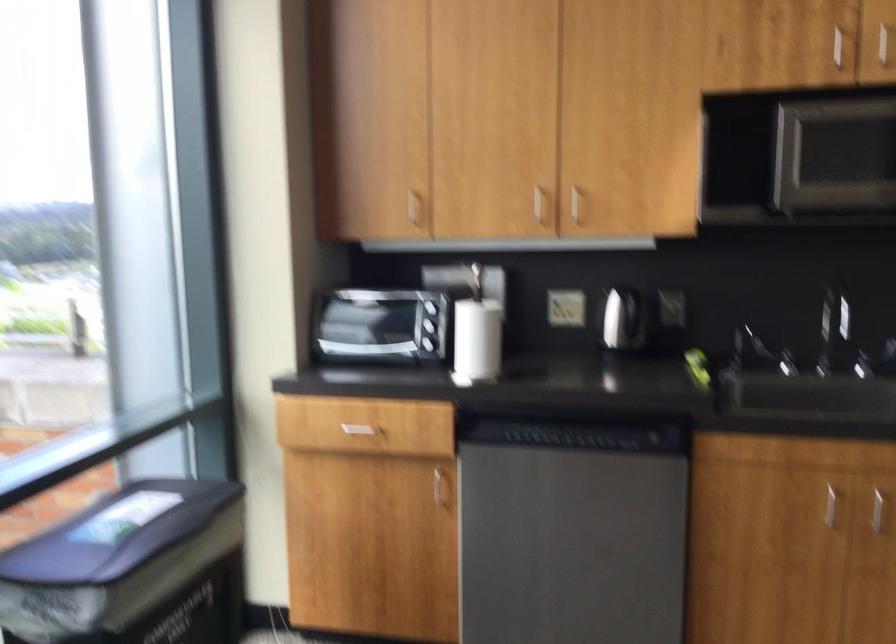
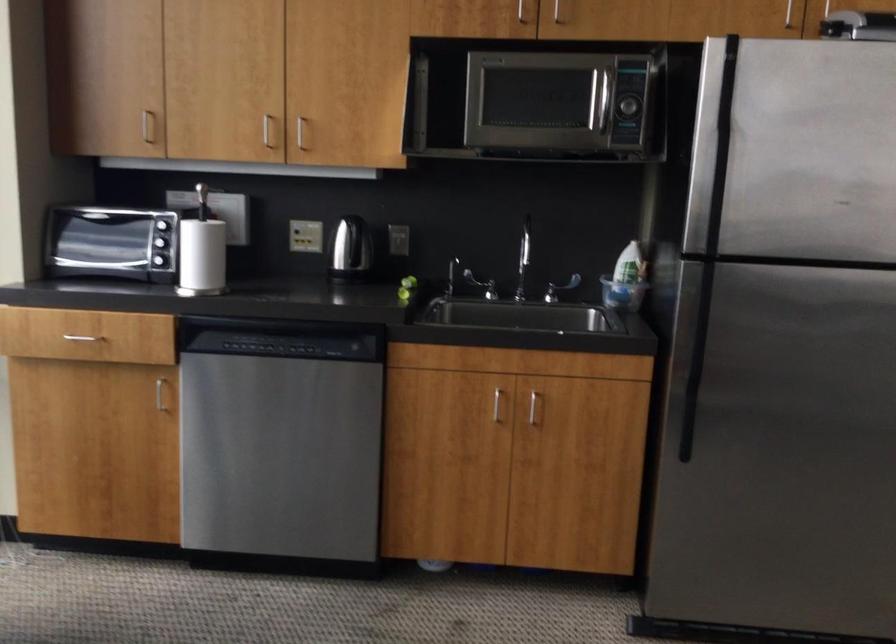
Find the pixel in the second image that matches [535,202] in the first image.

(266, 129)